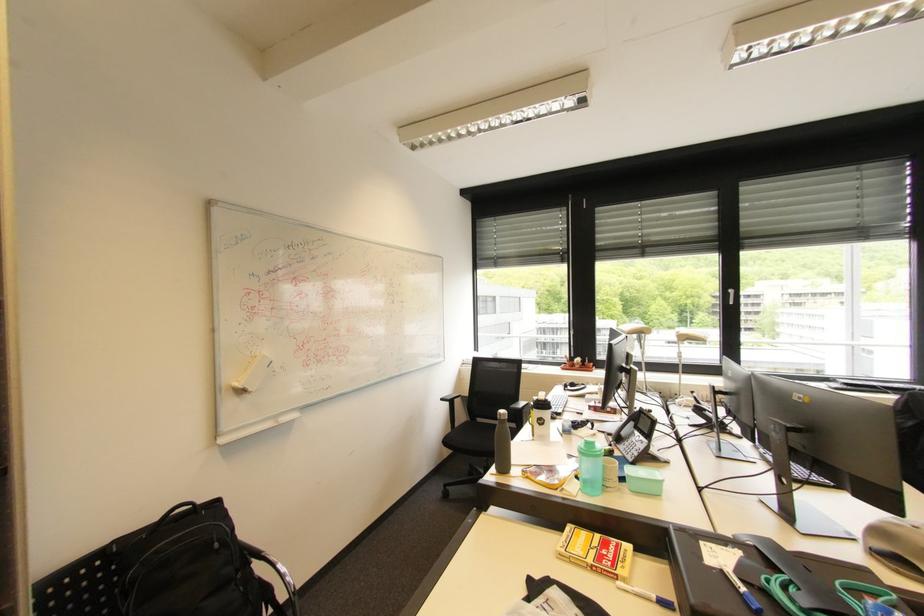
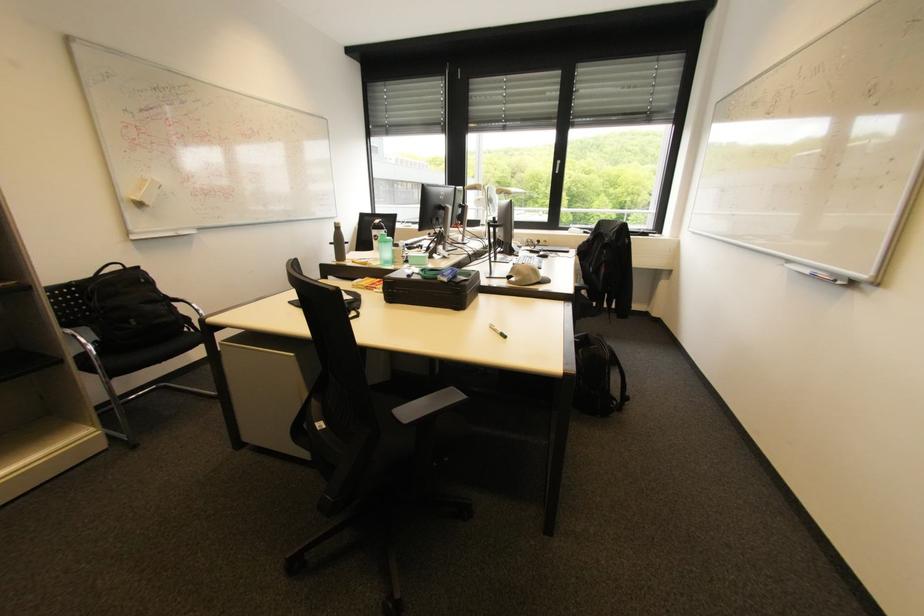
In a continuous first-person perspective shot, in which direction is the camera moving?

The cameraman moved toward right, backward.